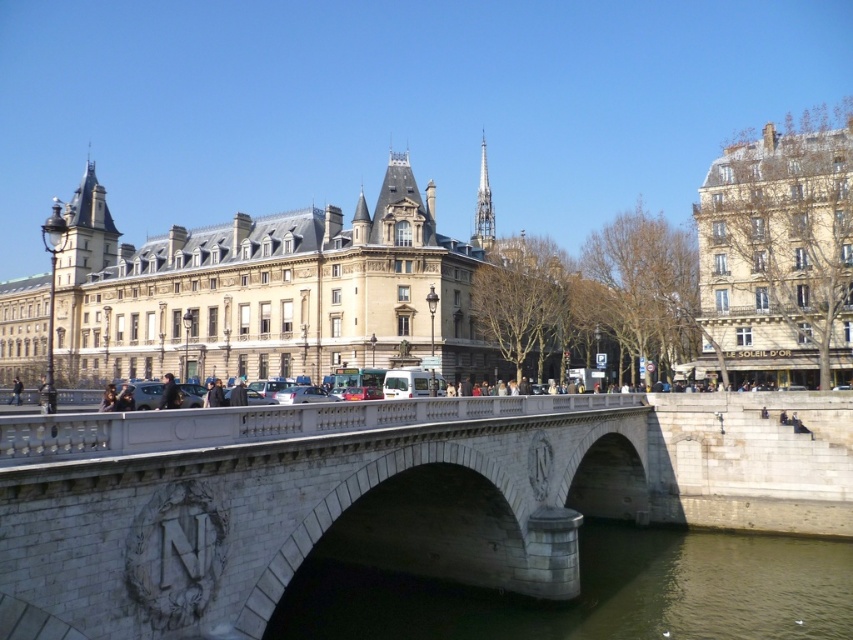
You are standing on the sidewalk next to the white stone bridge at center and want to take a photo of it. If your camera can focus on objects up to 100 feet away, will it be able to capture the bridge clearly?

The white stone bridge at center is 99.00 feet away from camera, so yes, the camera can focus on it clearly since it is within the 100 feet range.